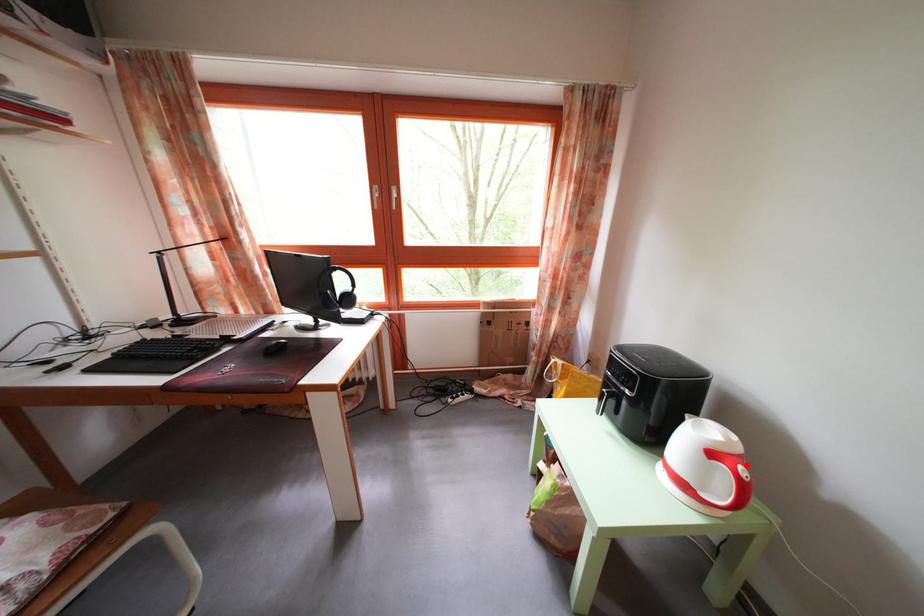
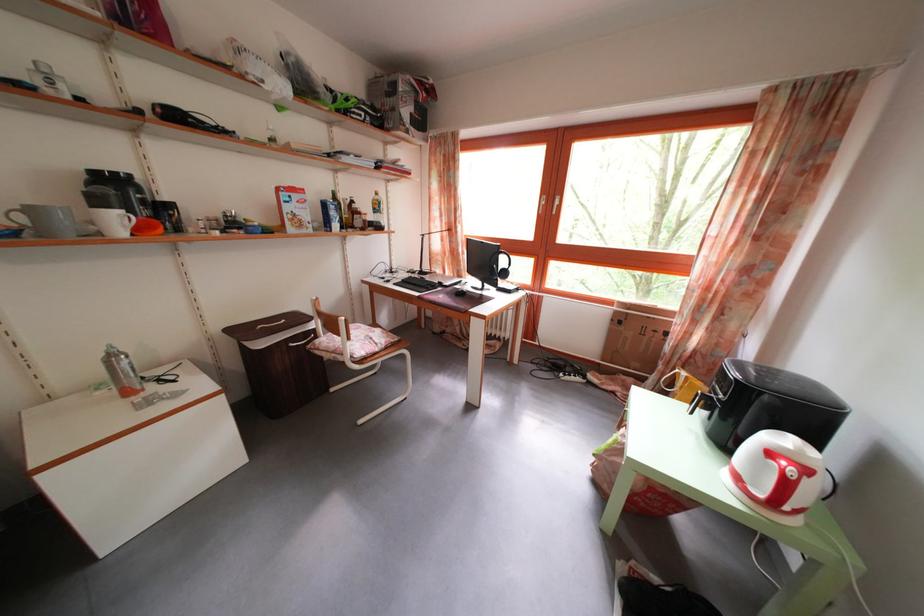
Question: I am providing you with two images of the same scene from different viewpoints. A red point is marked on the first image. Is the red point's position out of view in image 2?

Choices:
 (A) Yes
 (B) No

Answer: (B)